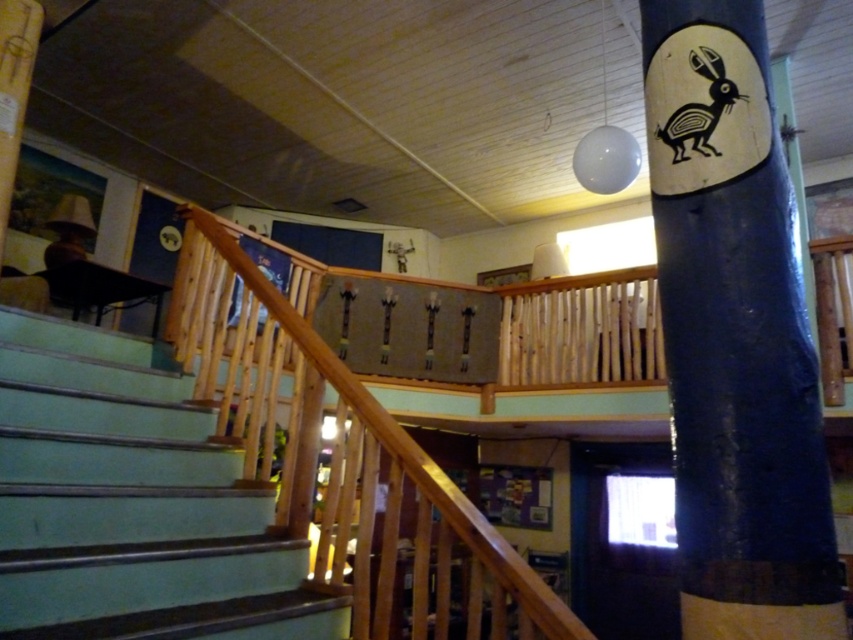
You are a delivery robot with a 1.6 meter wide package. You need to move from the teal painted wood stairs at lower left to the blue painted wood pole at center. Can you pass through the space between them without tilting the package?

The blue painted wood pole at center and teal painted wood stairs at lower left are 1.59 meters apart, which is slightly narrower than your 1.6 meter wide package. Therefore, you cannot pass through the space between them without tilting the package.

You are standing on the teal painted wood stairs at lower left and want to reach the blue painted wood pole at center. Which direction should you move to get closer to the pole?

You should move upward because the blue painted wood pole at center is located above the teal painted wood stairs at lower left.

You are an interior designer planning to place a decorative sphere between the blue painted wood pole at center and the wooden at upper center. Which pole should the sphere be placed closer to, the thinner or thicker one?

The blue painted wood pole at center is thinner than wooden at upper center, so the sphere should be placed closer to the blue painted wood pole at center to maintain balance.